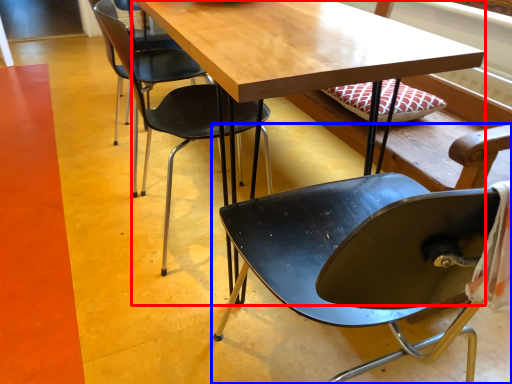
Question: Among these objects, which one is nearest to the camera, table (highlighted by a red box) or chair (highlighted by a blue box)?

Choices:
 (A) table
 (B) chair

Answer: (B)